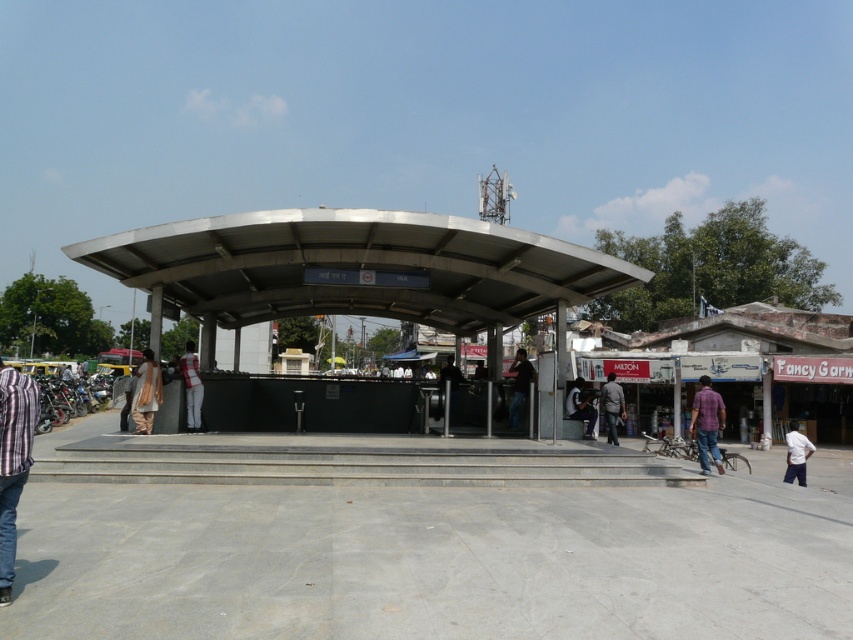
Is point (619, 394) farther from camera compared to point (581, 388)?

That is True.

Who is more forward, (608, 390) or (581, 380)?

→ Point (608, 390) is more forward.

Where is `dark brown leather jacket at center`? Image resolution: width=853 pixels, height=640 pixels. dark brown leather jacket at center is located at coordinates (612, 404).

Which is above, metallic bus stop at center or dark brown leather jacket at center?

Positioned higher is metallic bus stop at center.

Is metallic bus stop at center smaller than dark brown leather jacket at center?

No, metallic bus stop at center is not smaller than dark brown leather jacket at center.

Which is behind, point (194, 269) or point (601, 397)?

Positioned behind is point (601, 397).

At what (x,y) coordinates should I click in order to perform the action: click on metallic bus stop at center. Please return your answer as a coordinate pair (x, y). The width and height of the screenshot is (853, 640). Looking at the image, I should click on [x=354, y=269].

Between dark blue jeans at center and dark gray shirt at center, which one has more height?

Standing taller between the two is dark blue jeans at center.

From the picture: Between dark blue jeans at center and dark gray shirt at center, which one is positioned lower?

Positioned lower is dark gray shirt at center.

Between point (508, 369) and point (572, 406), which one is positioned in front?

Positioned in front is point (572, 406).

Identify the location of dark blue jeans at center. The width and height of the screenshot is (853, 640). (x=519, y=387).